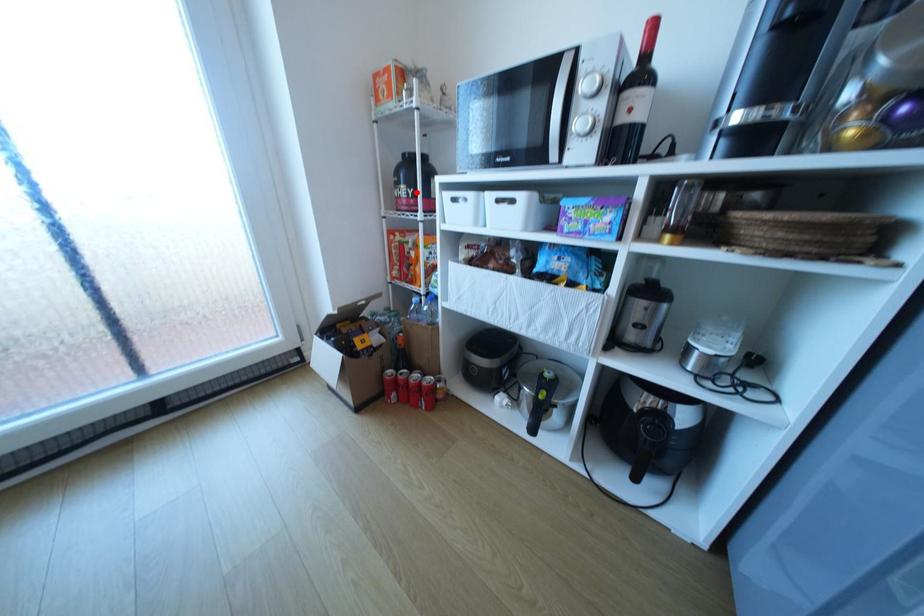
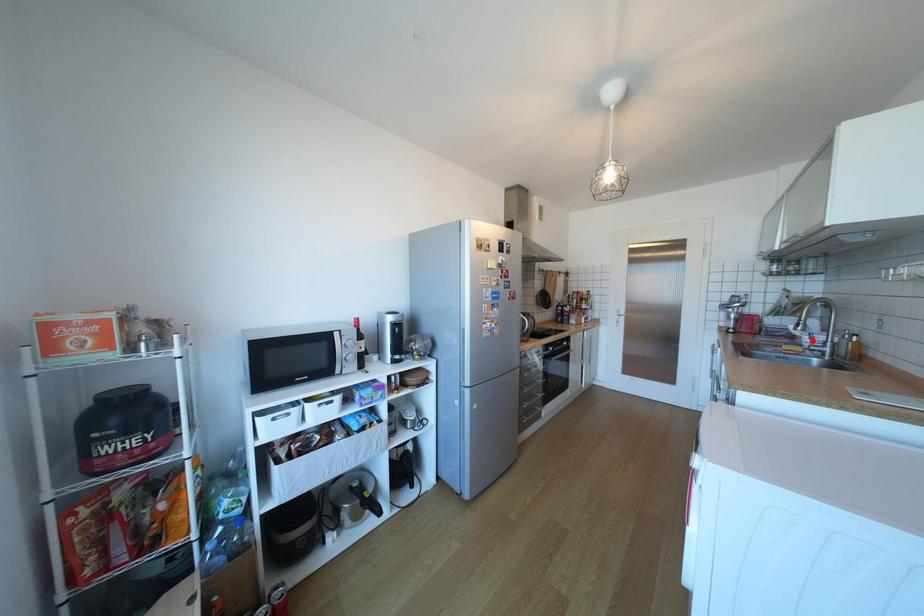
I am providing you with two images of the same scene from different viewpoints. A red point is marked on the first image and another point is marked on the second image. Is the red point in image1 aligned with the point shown in image2?

No